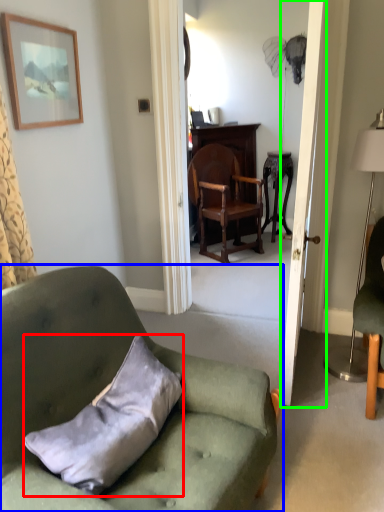
Question: Based on their relative distances, which object is nearer to pillow (highlighted by a red box)? Choose from chair (highlighted by a blue box) and door (highlighted by a green box).

Choices:
 (A) chair
 (B) door

Answer: (A)